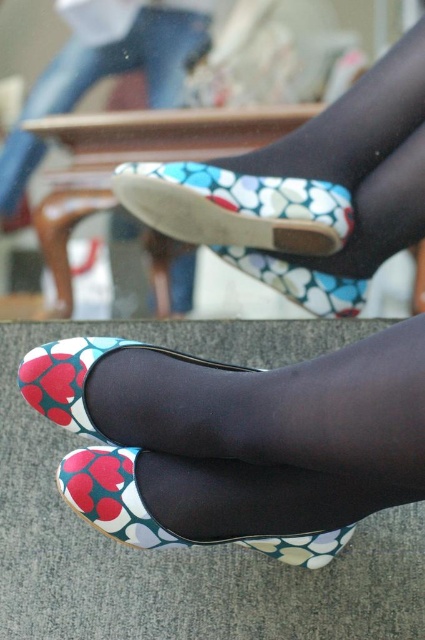
Does floral fabric shoe at center have a greater width compared to matte floral shoe at upper center?

Indeed, floral fabric shoe at center has a greater width compared to matte floral shoe at upper center.

Consider the image. Does floral fabric shoe at center have a lesser width compared to matte floral shoe at upper center?

In fact, floral fabric shoe at center might be wider than matte floral shoe at upper center.

The width and height of the screenshot is (425, 640). I want to click on floral fabric shoe at center, so click(x=235, y=208).

What do you see at coordinates (127, 60) in the screenshot?
I see `matte floral shoe at upper center` at bounding box center [127, 60].

Which is behind, point (192, 33) or point (65, 493)?

The point (192, 33) is more distant.

Identify the location of matte floral shoe at upper center. The height and width of the screenshot is (640, 425). (127, 60).

Does floral fabric shoe at center appear over matte floral shoe at center?

Yes, floral fabric shoe at center is above matte floral shoe at center.

Is floral fabric shoe at center to the left of matte floral shoe at center from the viewer's perspective?

Incorrect, floral fabric shoe at center is not on the left side of matte floral shoe at center.

This screenshot has height=640, width=425. Find the location of `floral fabric shoe at center`. floral fabric shoe at center is located at coordinates (235, 208).

Where is `floral fabric shoe at center`? This screenshot has height=640, width=425. floral fabric shoe at center is located at coordinates (235, 208).